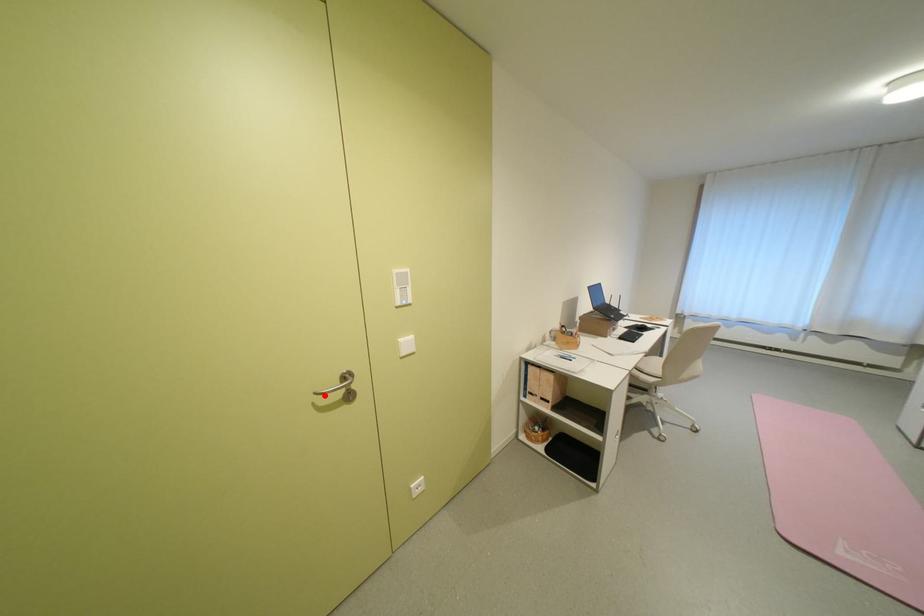
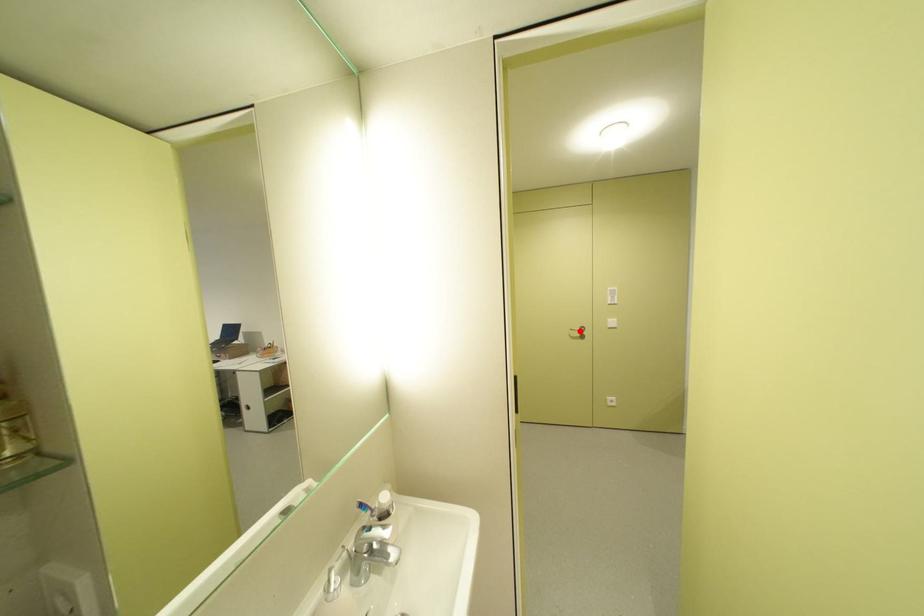
I am providing you with two images of the same scene from different viewpoints. A red point is marked on the first image and another point is marked on the second image. Is the marked point in image1 the same physical position as the marked point in image2?

Yes